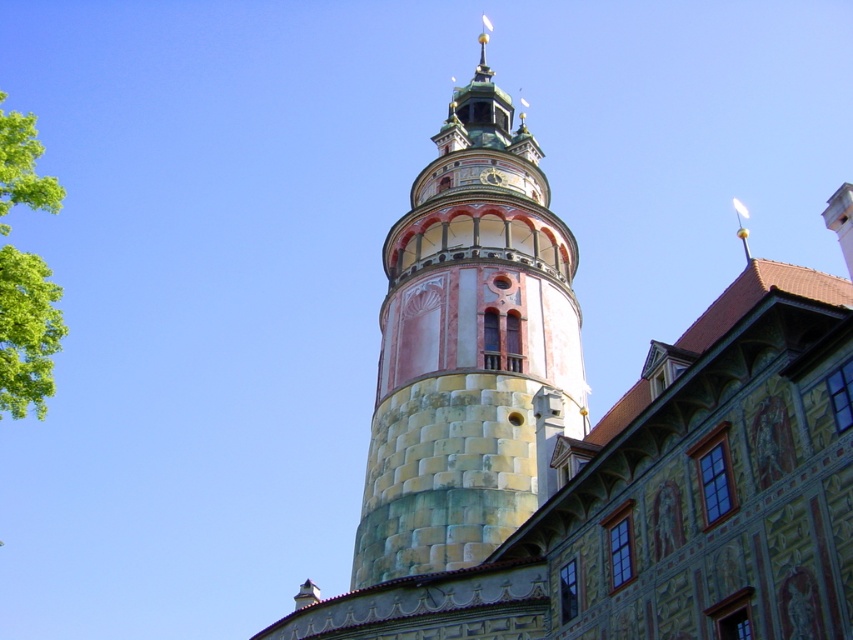
You are standing in front of the stone tower at center and want to take a photo of the green leafy tree at left. In which direction should you turn to face the tree?

You should turn to your left to face the green leafy tree at left since the stone tower at center is to the right of the tree.

You are standing in front of the stone tower at center and the green leafy tree at left. Which one appears taller in the image?

The stone tower at center is much taller than the green leafy tree at left.

Looking at this image, you are standing at the base of the tower and want to walk towards the flagpole. There are two points marked on the ground in front of you. One is at point (459, 516) and the other is at point (28, 195). Which point should you step on first to ensure you stay on the path leading to the flagpole?

You should step on point (28, 195) first because point (459, 516) is behind it, so stepping on the closer point first will keep you on the path towards the flagpole.